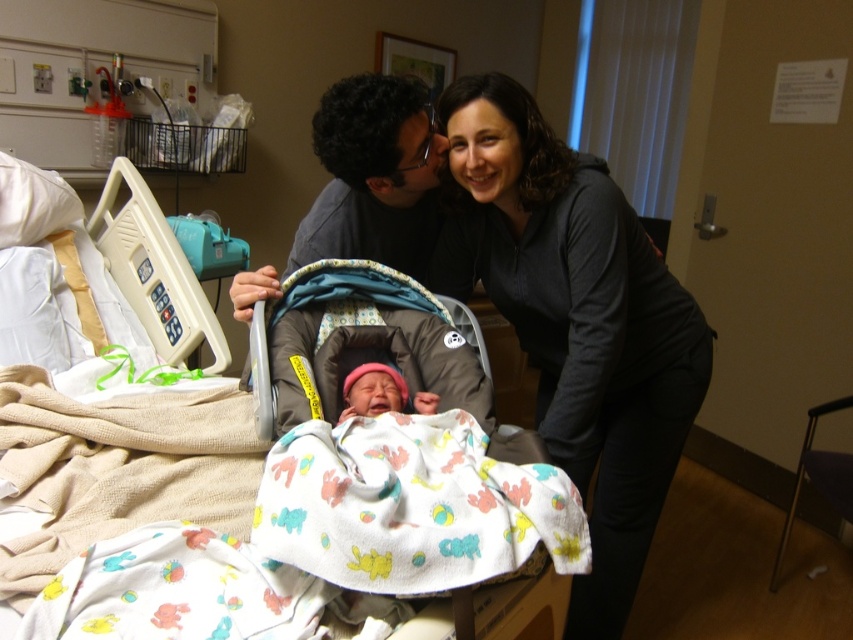
You are a nurse in a hospital room and need to move a baby from the car seat to a stroller. You have two options available in the room. The first is a brown fabric baby carriage at center, and the second is a matte gray stroller at center. Considering the space constraints in the room, which stroller would be easier to maneuver through the narrow hallway outside?

The matte gray stroller at center is easier to maneuver through the narrow hallway because it is narrower than the brown fabric baby carriage at center.

You are a nurse in a hospital room and need to place the pink fabric newborn at center into the brown fabric baby carriage at center. Based on the size of the baby and the carriage, will the newborn fit comfortably inside the carriage?

The brown fabric baby carriage at center is wider than the pink fabric newborn at center, so the newborn will fit comfortably inside the carriage.